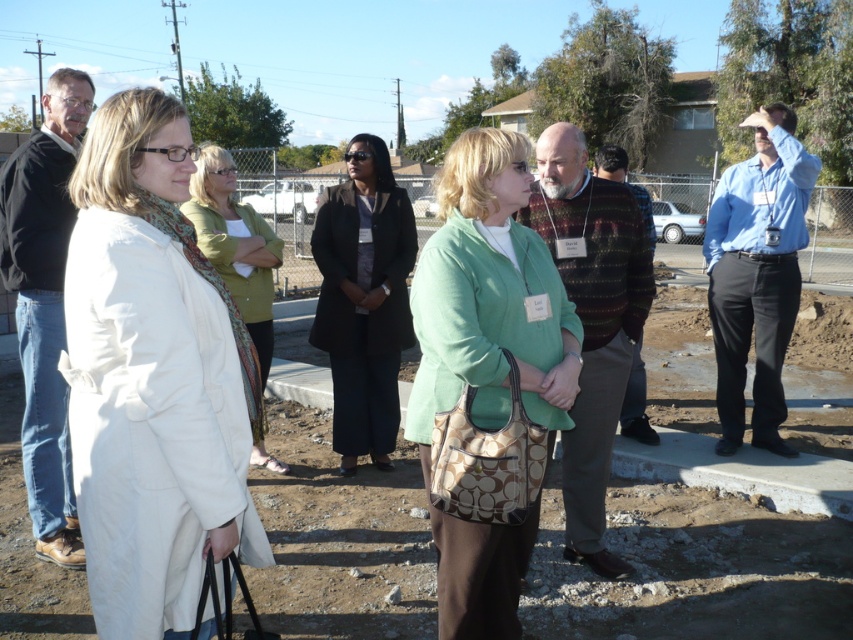
The height and width of the screenshot is (640, 853). What do you see at coordinates (489, 298) in the screenshot?
I see `green matte sweater at center` at bounding box center [489, 298].

Which of these two, green matte sweater at center or white matte coat at center, stands shorter?

With less height is white matte coat at center.

Is point (486, 410) positioned in front of point (212, 148)?

Yes, it is in front of point (212, 148).

At what (x,y) coordinates should I click in order to perform the action: click on green matte sweater at center. Please return your answer as a coordinate pair (x, y). Looking at the image, I should click on (489, 298).

Can you confirm if white fabric coat at left is bigger than white matte coat at center?

Indeed, white fabric coat at left has a larger size compared to white matte coat at center.

Is white fabric coat at left taller than white matte coat at center?

Incorrect, white fabric coat at left's height is not larger of white matte coat at center's.

Where is `white fabric coat at left`? This screenshot has height=640, width=853. white fabric coat at left is located at coordinates (152, 378).

The image size is (853, 640). Find the location of `white fabric coat at left`. white fabric coat at left is located at coordinates (152, 378).

Is white fabric coat at left thinner than dark gray coat at center?

→ Yes.

Between white fabric coat at left and dark gray coat at center, which one appears on the right side from the viewer's perspective?

dark gray coat at center

Is point (96, 476) positioned behind point (383, 228)?

No.

Where is `white fabric coat at left`? white fabric coat at left is located at coordinates (152, 378).